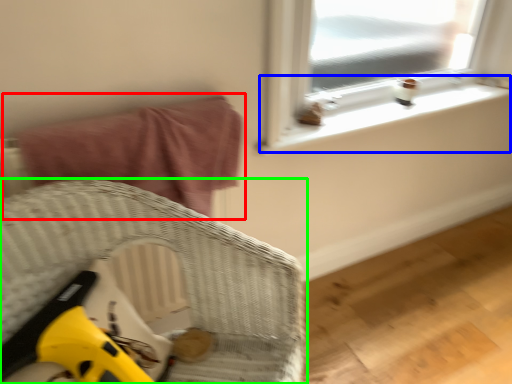
Question: Estimate the real-world distances between objects in this image. Which object is closer to bed (highlighted by a red box), window sill (highlighted by a blue box) or furniture (highlighted by a green box)?

Choices:
 (A) window sill
 (B) furniture

Answer: (B)